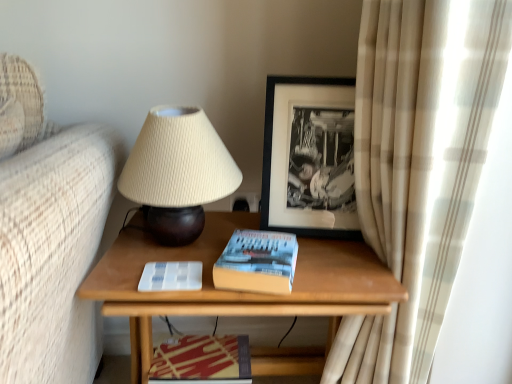
What is the approximate width of red glossy magazine at lower center?

The width of red glossy magazine at lower center is 6.84 inches.

Measure the distance between point (184, 136) and camera.

31.06 inches.

This screenshot has height=384, width=512. Describe the element at coordinates (309, 158) in the screenshot. I see `black matte picture frame at upper center` at that location.

The height and width of the screenshot is (384, 512). Identify the location of beige plaid curtain at right. (418, 167).

This screenshot has height=384, width=512. What are the coordinates of `hardcover book at center` in the screenshot? It's located at (257, 262).

I want to click on red glossy magazine at lower center, so click(x=202, y=360).

At what (x,y) coordinates should I click in order to perform the action: click on paperback book behind the wooden table at center. Please return your answer as a coordinate pair (x, y). The height and width of the screenshot is (384, 512). Looking at the image, I should click on (257, 262).

Is hardcover book at center turned away from wooden table at center?

That's not correct — hardcover book at center is not looking away from wooden table at center.

Considering the positions of objects hardcover book at center and wooden table at center in the image provided, who is behind, hardcover book at center or wooden table at center?

hardcover book at center.

From a real-world perspective, is hardcover book at center below wooden table at center?

No, from a real-world perspective, hardcover book at center is not below wooden table at center.

Between point (395, 367) and point (139, 262), which one is positioned behind?

The point (395, 367) is behind.

Based on the photo, can you confirm if beige plaid curtain at right is shorter than wooden table at center?

No, beige plaid curtain at right is not shorter than wooden table at center.

From a real-world perspective, is beige plaid curtain at right physically above wooden table at center?

Yes, from a real-world perspective, beige plaid curtain at right is on top of wooden table at center.

Considering the relative positions of black matte picture frame at upper center and hardcover book at center in the image provided, is black matte picture frame at upper center behind hardcover book at center?

Yes, black matte picture frame at upper center is further from the viewer.

Is black matte picture frame at upper center aimed at hardcover book at center?

Yes, black matte picture frame at upper center is oriented towards hardcover book at center.

Does black matte picture frame at upper center appear on the left side of hardcover book at center?

In fact, black matte picture frame at upper center is to the right of hardcover book at center.

Considering the relative positions of beige ribbed fabric lampshade at upper center and beige plaid curtain at right in the image provided, is beige ribbed fabric lampshade at upper center in front of beige plaid curtain at right?

No, it is behind beige plaid curtain at right.

Looking at this image, from a real-world perspective, is beige ribbed fabric lampshade at upper center physically located above or below beige plaid curtain at right?

beige ribbed fabric lampshade at upper center is above beige plaid curtain at right.

Is beige ribbed fabric lampshade at upper center located outside beige plaid curtain at right?

Indeed, beige ribbed fabric lampshade at upper center is completely outside beige plaid curtain at right.

Considering the relative sizes of beige ribbed fabric lampshade at upper center and beige plaid curtain at right in the image provided, is beige ribbed fabric lampshade at upper center smaller than beige plaid curtain at right?

Correct, beige ribbed fabric lampshade at upper center occupies less space than beige plaid curtain at right.

Can you see wooden table at center touching black matte picture frame at upper center?

wooden table at center and black matte picture frame at upper center are not in contact.

Does wooden table at center come in front of black matte picture frame at upper center?

Yes, wooden table at center is closer to the viewer.

Looking at this image, does wooden table at center have a larger size compared to black matte picture frame at upper center?

Correct, wooden table at center is larger in size than black matte picture frame at upper center.

Between point (253, 277) and point (124, 226), which one is positioned in front?

The point (253, 277) is in front.

Which object is positioned more to the right, hardcover book at center or beige ribbed fabric lampshade at upper center?

Positioned to the right is hardcover book at center.

How distant is hardcover book at center from beige ribbed fabric lampshade at upper center?

6.86 inches.

Considering the relative sizes of hardcover book at center and beige ribbed fabric lampshade at upper center in the image provided, is hardcover book at center thinner than beige ribbed fabric lampshade at upper center?

No, hardcover book at center is not thinner than beige ribbed fabric lampshade at upper center.

Relative to wooden table at center, is beige ribbed fabric lampshade at upper center in front or behind?

beige ribbed fabric lampshade at upper center is positioned farther from the viewer than wooden table at center.

Can you confirm if beige ribbed fabric lampshade at upper center is bigger than wooden table at center?

No.

Is point (157, 108) in front of point (136, 367)?

No, (157, 108) is behind (136, 367).

Does beige ribbed fabric lampshade at upper center appear on the left side of wooden table at center?

Yes.

Identify the location of paperback book lying above the wooden table at center (from the image's perspective). (257, 262).

Identify the location of table that appears below the beige plaid curtain at right (from a real-world perspective). The height and width of the screenshot is (384, 512). (241, 292).

Looking at the image, which one is located closer to beige plaid curtain at right, hardcover book at center or beige ribbed fabric lampshade at upper center?

Based on the image, hardcover book at center appears to be nearer to beige plaid curtain at right.

Considering their positions, is hardcover book at center positioned closer to wooden table at center than black matte picture frame at upper center?

Based on the image, hardcover book at center appears to be nearer to wooden table at center.

Looking at the image, which one is located further to beige ribbed fabric lampshade at upper center, black matte picture frame at upper center or wooden table at center?

black matte picture frame at upper center is positioned further to the anchor beige ribbed fabric lampshade at upper center.

Based on their spatial positions, is beige ribbed fabric lampshade at upper center or beige plaid curtain at right closer to hardcover book at center?

Based on the image, beige ribbed fabric lampshade at upper center appears to be nearer to hardcover book at center.

Which object lies further to the anchor point beige plaid curtain at right, wooden table at center or hardcover book at center?

hardcover book at center is positioned further to the anchor beige plaid curtain at right.

Looking at the image, which one is located closer to black matte picture frame at upper center, red glossy magazine at lower center or hardcover book at center?

Among the two, hardcover book at center is located nearer to black matte picture frame at upper center.

Looking at the image, which one is located closer to beige plaid curtain at right, red glossy magazine at lower center or wooden table at center?

wooden table at center is closer to beige plaid curtain at right.

Based on the photo, when comparing their distances from black matte picture frame at upper center, does beige plaid curtain at right or wooden table at center seem further?

The object further to black matte picture frame at upper center is wooden table at center.

This screenshot has width=512, height=384. In order to click on paperback book between beige ribbed fabric lampshade at upper center and black matte picture frame at upper center from left to right in this screenshot , I will do `click(257, 262)`.

Locate an element on the screen. The width and height of the screenshot is (512, 384). paperback book located between wooden table at center and beige plaid curtain at right in the left-right direction is located at coordinates (257, 262).

At what (x,y) coordinates should I click in order to perform the action: click on table between red glossy magazine at lower center and beige plaid curtain at right from left to right. Please return your answer as a coordinate pair (x, y). The width and height of the screenshot is (512, 384). Looking at the image, I should click on (241, 292).

Locate an element on the screen. The width and height of the screenshot is (512, 384). lamp between black matte picture frame at upper center and wooden table at center vertically is located at coordinates (177, 173).